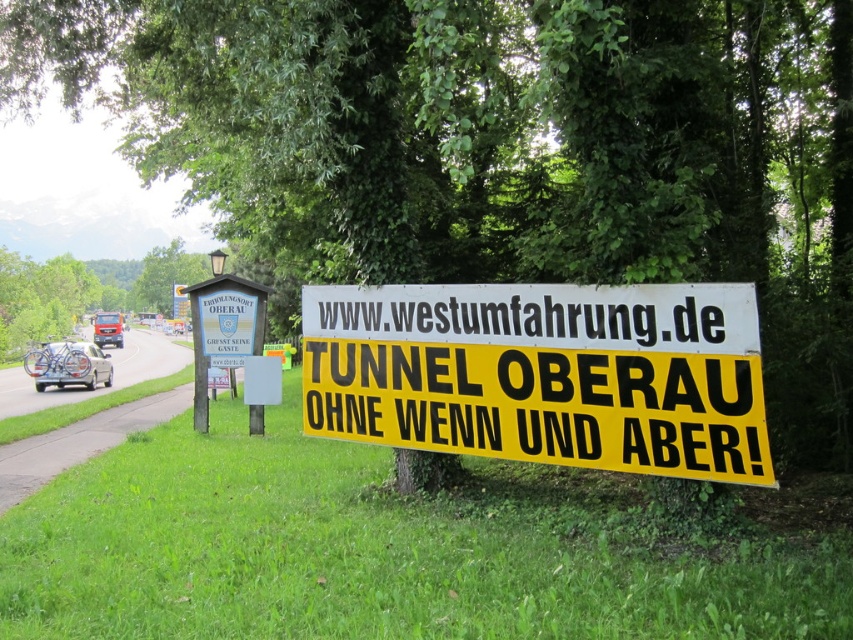
Question: From the image, what is the correct spatial relationship of wooden signboard at left in relation to metallic silver van at left?

Choices:
 (A) below
 (B) above

Answer: (B)

Question: Which is nearer to the yellow paper sign at center?

Choices:
 (A) metallic silver van at left
 (B) white matte car at left
 (C) wooden signboard at left

Answer: (C)

Question: Which of these objects is positioned farthest from the yellow paper sign at center?

Choices:
 (A) wooden signboard at left
 (B) white matte car at left

Answer: (B)

Question: Does yellow paper sign at center have a greater width compared to metallic silver van at left?

Choices:
 (A) no
 (B) yes

Answer: (A)

Question: Which is nearer to the yellow paper sign at center?

Choices:
 (A) metallic silver van at left
 (B) white matte car at left

Answer: (B)

Question: Can you confirm if yellow paper sign at center is positioned to the left of metallic silver van at left?

Choices:
 (A) no
 (B) yes

Answer: (A)